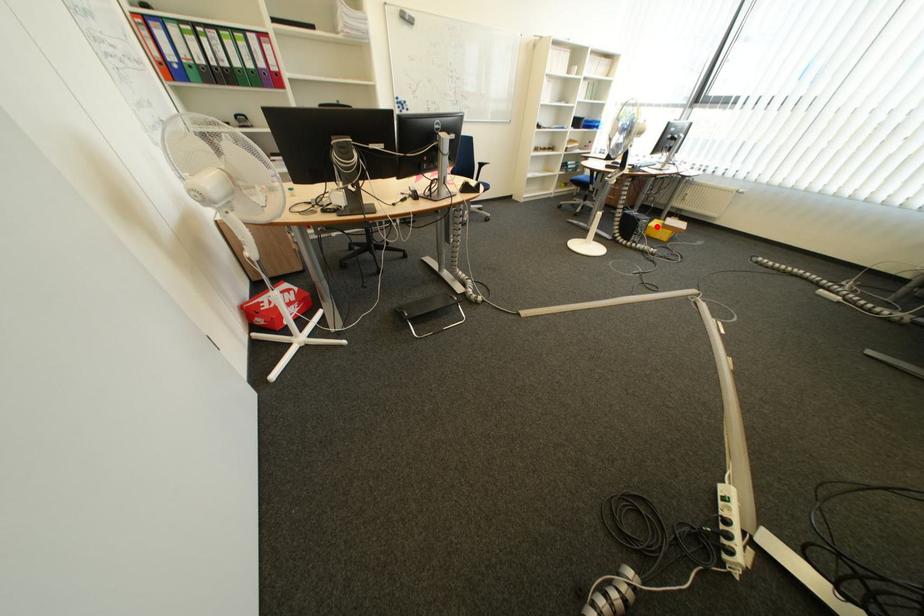
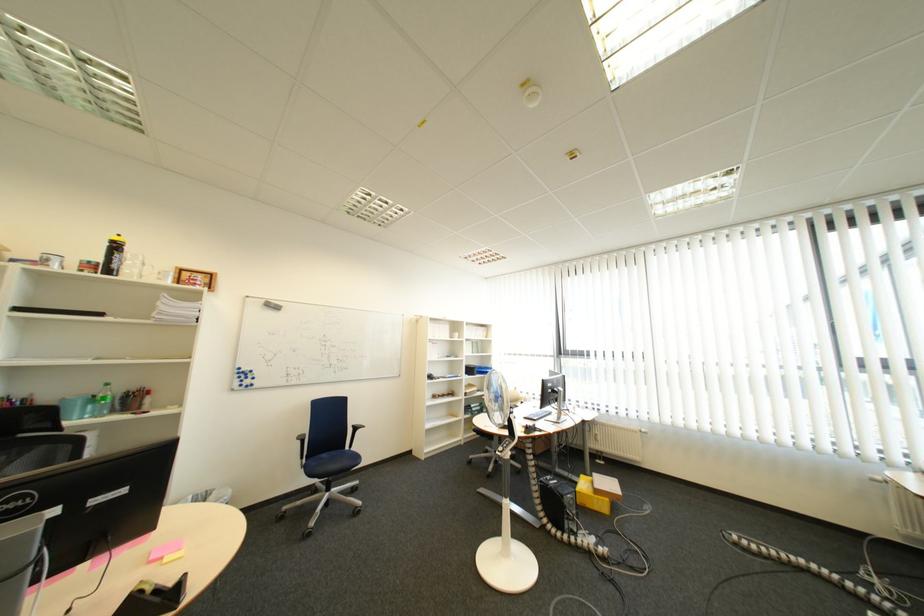
Question: I am providing you with two images of the same scene from different viewpoints. A red point is marked on the first image. Is the red point's position out of view in image 2?

Choices:
 (A) Yes
 (B) No

Answer: (B)